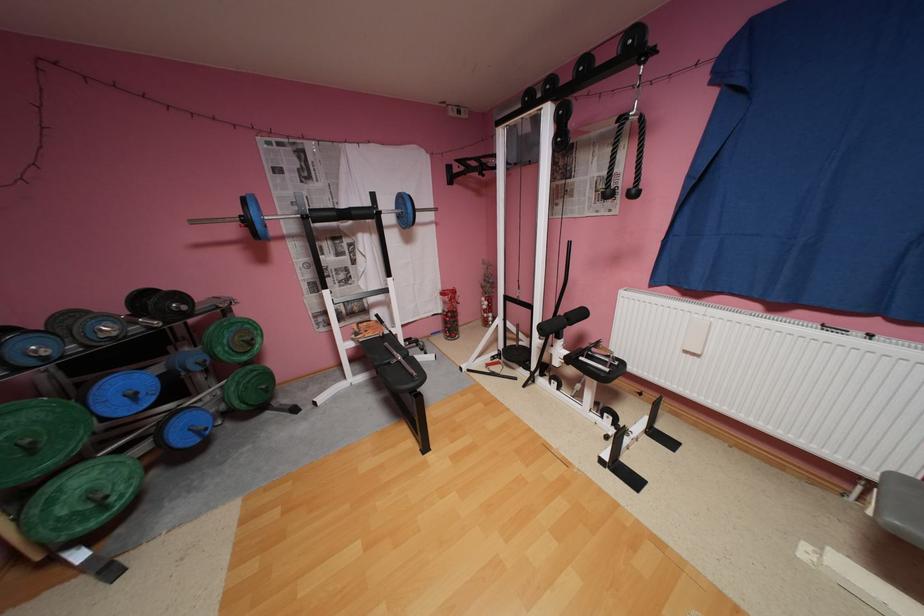
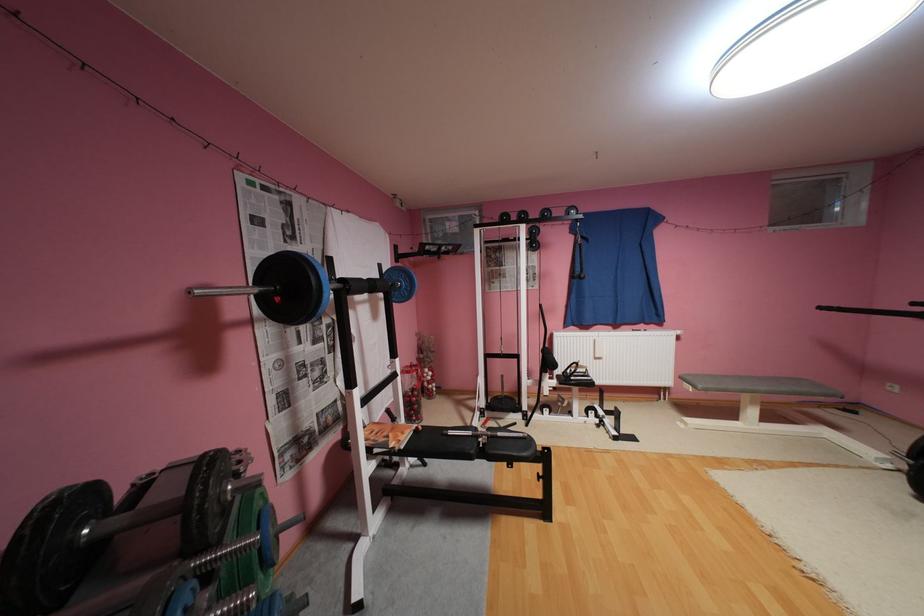
The point at (460, 177) is marked in the first image. Where is the corresponding point in the second image?

(407, 256)